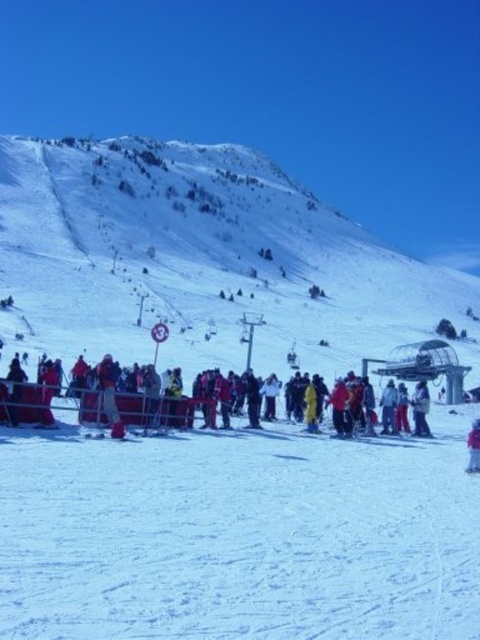
Question: Is red fabric crowd at center above pink fabric at center?

Choices:
 (A) yes
 (B) no

Answer: (A)

Question: Which object appears farthest from the camera in this image?

Choices:
 (A) pink fabric at center
 (B) red fabric crowd at center
 (C) white matte jacket at center

Answer: (C)

Question: Which object is closer to the camera taking this photo?

Choices:
 (A) pink fabric at center
 (B) red fabric crowd at center
 (C) white matte jacket at center

Answer: (A)

Question: Does red fabric crowd at center have a larger size compared to white matte jacket at center?

Choices:
 (A) yes
 (B) no

Answer: (A)

Question: Among these objects, which one is nearest to the camera?

Choices:
 (A) red fabric crowd at center
 (B) white matte jacket at center
 (C) pink fabric at center

Answer: (C)

Question: Is white matte jacket at center below pink fabric at center?

Choices:
 (A) no
 (B) yes

Answer: (A)